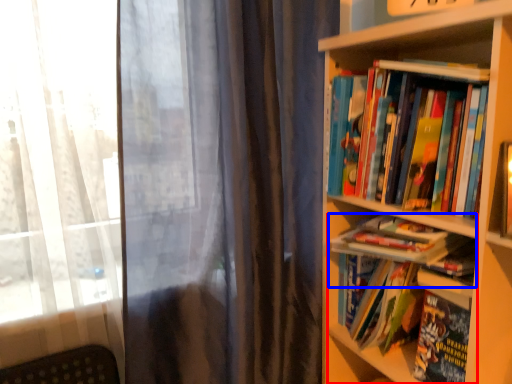
Question: Which object is closer to the camera taking this photo, book (highlighted by a red box) or book (highlighted by a blue box)?

Choices:
 (A) book
 (B) book

Answer: (A)